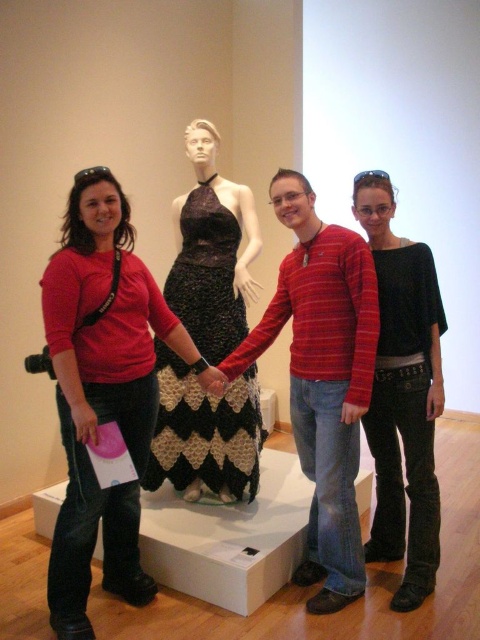
Can you confirm if matte red shirt at center is wider than striped cotton shirt at center?

Yes.

Is point (75, 353) farther from camera compared to point (370, 320)?

No, (75, 353) is in front of (370, 320).

Locate an element on the screen. This screenshot has height=640, width=480. matte red shirt at center is located at coordinates (103, 392).

Can you confirm if striped cotton shirt at center is positioned above black jersey at center?

No.

Between point (335, 396) and point (396, 500), which one is positioned behind?

Positioned behind is point (396, 500).

Image resolution: width=480 pixels, height=640 pixels. Describe the element at coordinates (323, 378) in the screenshot. I see `striped cotton shirt at center` at that location.

Locate an element on the screen. This screenshot has width=480, height=640. striped cotton shirt at center is located at coordinates (323, 378).

Is striped cotton shirt at center further to the viewer compared to black crochet dress at center?

No, striped cotton shirt at center is in front of black crochet dress at center.

Between point (288, 264) and point (215, 488), which one is positioned behind?

Point (215, 488)

Locate an element on the screen. This screenshot has width=480, height=640. striped cotton shirt at center is located at coordinates (323, 378).